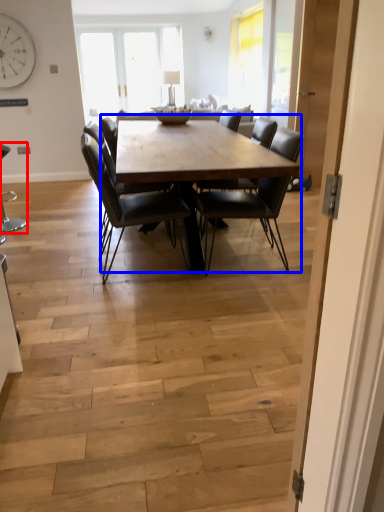
Question: Which object is further to the camera taking this photo, chair (highlighted by a red box) or coffee table (highlighted by a blue box)?

Choices:
 (A) chair
 (B) coffee table

Answer: (A)